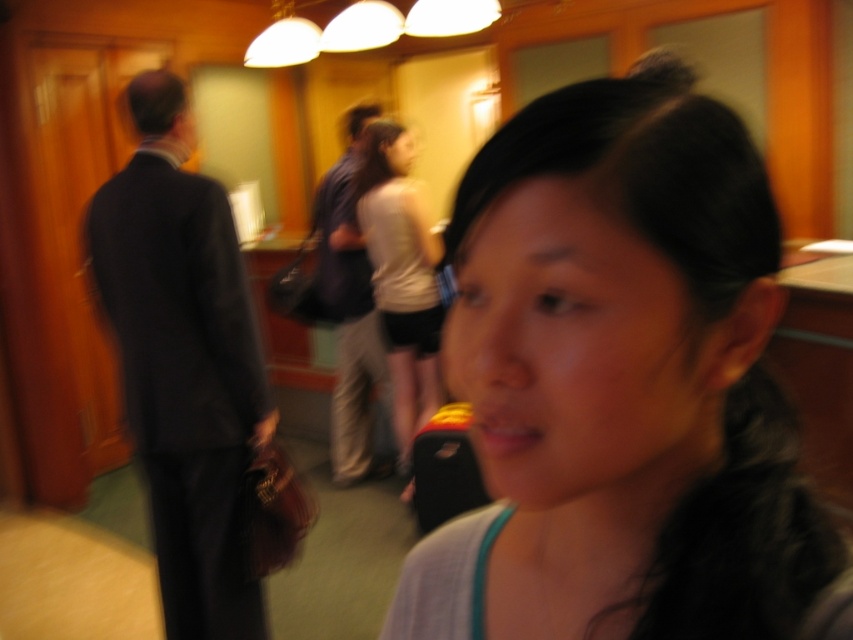
Question: Can you confirm if smooth skin face at center is thinner than dark blue suit at left?

Choices:
 (A) no
 (B) yes

Answer: (B)

Question: In this image, where is white matte shirt at center located relative to dark blue suit at center?

Choices:
 (A) right
 (B) left

Answer: (A)

Question: Estimate the real-world distances between objects in this image. Which object is closer to the dark blue suit at left?

Choices:
 (A) smooth skin face at center
 (B) dark blue suit at center
 (C) white matte shirt at center

Answer: (C)

Question: Which object is the farthest from the dark blue suit at center?

Choices:
 (A) white matte shirt at center
 (B) smooth skin face at center

Answer: (B)

Question: Considering the relative positions of dark blue suit at left and dark blue suit at center in the image provided, where is dark blue suit at left located with respect to dark blue suit at center?

Choices:
 (A) left
 (B) right

Answer: (A)

Question: Which object appears farthest from the camera in this image?

Choices:
 (A) smooth skin face at center
 (B) white matte shirt at center
 (C) dark blue suit at left
 (D) dark blue suit at center

Answer: (D)